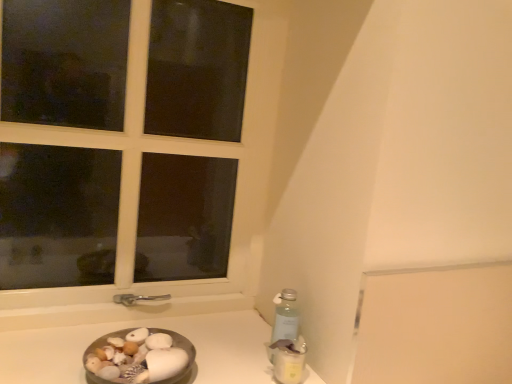
Question: Does translucent plastic bottle at lower right have a lesser height compared to white plastic window at upper left?

Choices:
 (A) no
 (B) yes

Answer: (B)

Question: Would you say translucent plastic bottle at lower right is outside white plastic window at upper left?

Choices:
 (A) yes
 (B) no

Answer: (A)

Question: Is translucent plastic bottle at lower right directly adjacent to white plastic window at upper left?

Choices:
 (A) yes
 (B) no

Answer: (B)

Question: Can you confirm if translucent plastic bottle at lower right is thinner than white plastic window at upper left?

Choices:
 (A) no
 (B) yes

Answer: (A)

Question: Can you confirm if translucent plastic bottle at lower right is positioned to the left of white plastic window at upper left?

Choices:
 (A) no
 (B) yes

Answer: (A)

Question: From the image's perspective, would you say translucent plastic bottle at lower right is shown under white plastic window at upper left?

Choices:
 (A) yes
 (B) no

Answer: (A)

Question: Does white plastic window at upper left contain metallic silver bowl at lower left?

Choices:
 (A) no
 (B) yes

Answer: (A)

Question: Can you confirm if white plastic window at upper left is bigger than metallic silver bowl at lower left?

Choices:
 (A) no
 (B) yes

Answer: (B)

Question: Can you confirm if white plastic window at upper left is shorter than metallic silver bowl at lower left?

Choices:
 (A) no
 (B) yes

Answer: (A)

Question: Can you confirm if white plastic window at upper left is wider than metallic silver bowl at lower left?

Choices:
 (A) yes
 (B) no

Answer: (B)

Question: Is white plastic window at upper left oriented away from metallic silver bowl at lower left?

Choices:
 (A) yes
 (B) no

Answer: (B)

Question: Is white plastic window at upper left in contact with metallic silver bowl at lower left?

Choices:
 (A) no
 (B) yes

Answer: (A)

Question: Would you say metallic silver bowl at lower left is part of smooth white shells at lower left's contents?

Choices:
 (A) no
 (B) yes

Answer: (A)